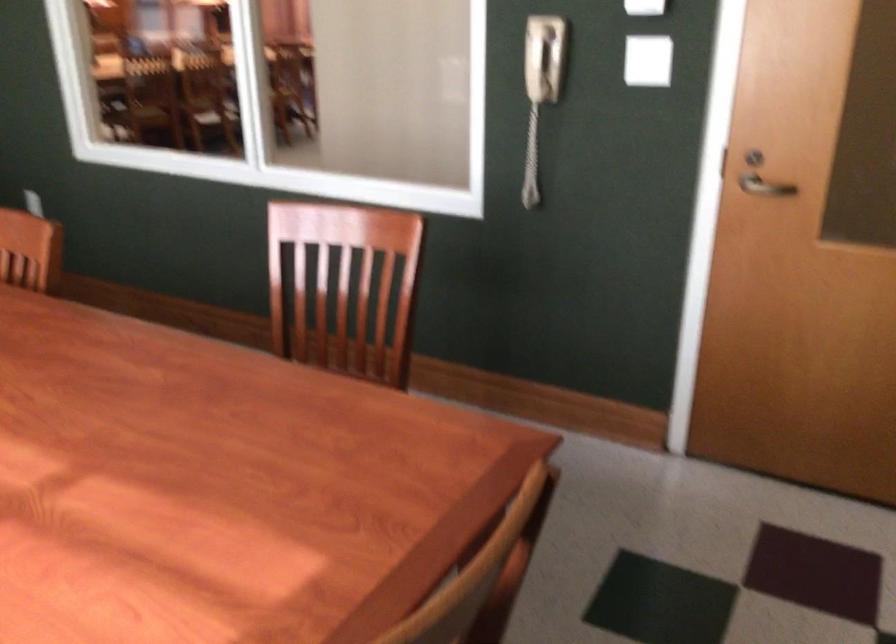
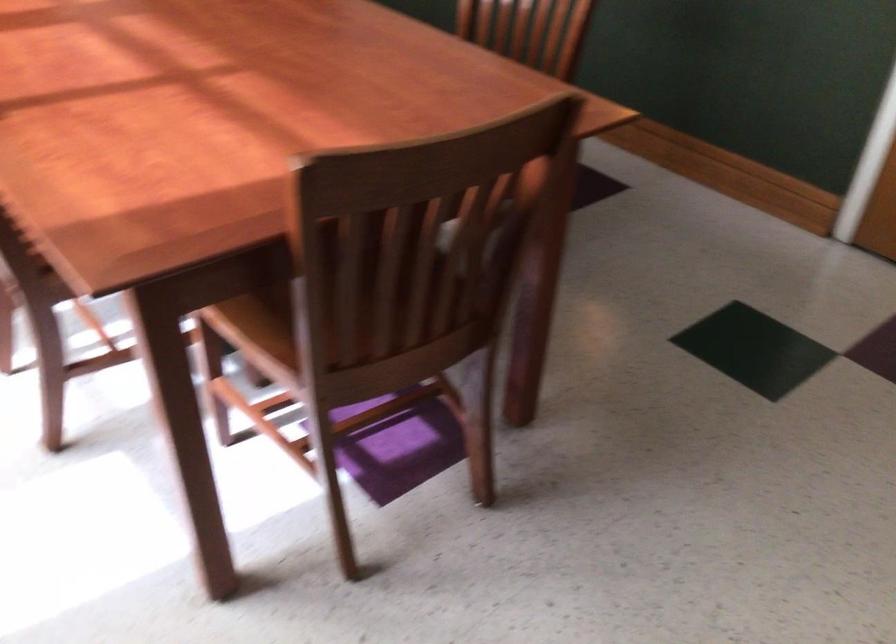
The images are taken continuously from a first-person perspective. In which direction are you moving?

The movement direction of the cameraman is right, backward.